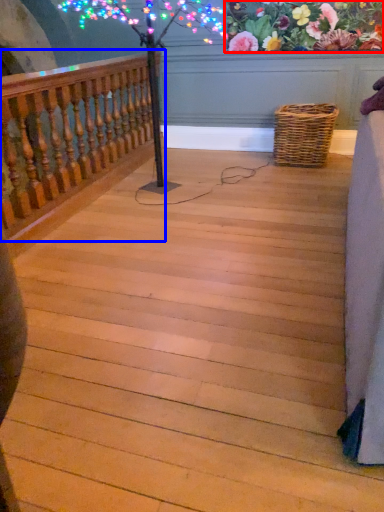
Question: Which object appears closest to the camera in this image, floral arrangement (highlighted by a red box) or rail (highlighted by a blue box)?

Choices:
 (A) floral arrangement
 (B) rail

Answer: (B)